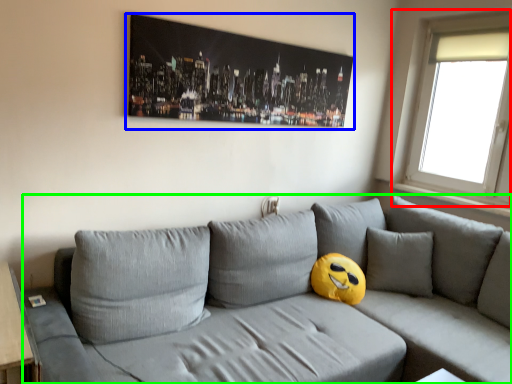
Question: Based on their relative distances, which object is nearer to window (highlighted by a red box)? Choose from picture frame (highlighted by a blue box) and studio couch (highlighted by a green box).

Choices:
 (A) picture frame
 (B) studio couch

Answer: (B)